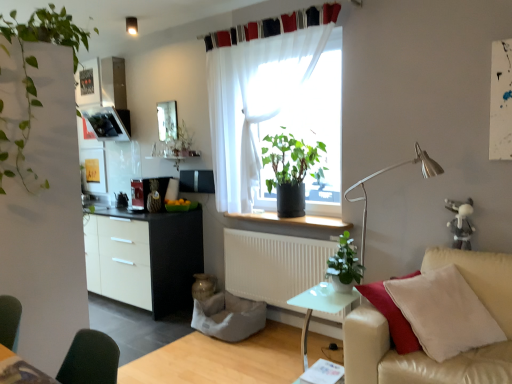
Question: From the image's perspective, is white matte cabinet at left located above metallic silver toaster at left?

Choices:
 (A) yes
 (B) no

Answer: (B)

Question: Is white matte cabinet at left wider than metallic silver toaster at left?

Choices:
 (A) yes
 (B) no

Answer: (A)

Question: Is white matte cabinet at left positioned before metallic silver toaster at left?

Choices:
 (A) no
 (B) yes

Answer: (B)

Question: Can you confirm if white matte cabinet at left is bigger than metallic silver toaster at left?

Choices:
 (A) yes
 (B) no

Answer: (A)

Question: Considering the relative sizes of white matte cabinet at left and metallic silver toaster at left in the image provided, is white matte cabinet at left taller than metallic silver toaster at left?

Choices:
 (A) no
 (B) yes

Answer: (B)

Question: Is white sheer curtain at upper center, which is the 2th curtain from bottom to top, inside or outside of metallic silver toaster at left?

Choices:
 (A) inside
 (B) outside

Answer: (B)

Question: Is white sheer curtain at upper center, which is the 2th curtain from bottom to top, taller or shorter than metallic silver toaster at left?

Choices:
 (A) short
 (B) tall

Answer: (A)

Question: From a real-world perspective, is white sheer curtain at upper center, which is the 2th curtain from bottom to top, positioned above or below metallic silver toaster at left?

Choices:
 (A) below
 (B) above

Answer: (B)

Question: Visually, is white sheer curtain at upper center, acting as the 1th curtain starting from the top, positioned to the left or to the right of metallic silver toaster at left?

Choices:
 (A) right
 (B) left

Answer: (A)

Question: Based on their sizes in the image, would you say white sheer curtain at upper center, which appears as the second curtain when viewed from the top, is bigger or smaller than translucent fabric at center, placed as the 2th window screen when sorted from left to right?

Choices:
 (A) big
 (B) small

Answer: (A)

Question: Considering the positions of white sheer curtain at upper center, acting as the first curtain starting from the bottom, and translucent fabric at center, arranged as the 1th window screen when viewed from the right, in the image, is white sheer curtain at upper center, acting as the first curtain starting from the bottom, wider or thinner than translucent fabric at center, arranged as the 1th window screen when viewed from the right,?

Choices:
 (A) wide
 (B) thin

Answer: (B)

Question: Considering the positions of white sheer curtain at upper center, acting as the first curtain starting from the bottom, and translucent fabric at center, arranged as the 1th window screen when viewed from the right, in the image, is white sheer curtain at upper center, acting as the first curtain starting from the bottom, taller or shorter than translucent fabric at center, arranged as the 1th window screen when viewed from the right,?

Choices:
 (A) short
 (B) tall

Answer: (B)

Question: Which is correct: white sheer curtain at upper center, which appears as the second curtain when viewed from the top, is inside translucent fabric at center, placed as the 2th window screen when sorted from left to right, or outside of it?

Choices:
 (A) inside
 (B) outside

Answer: (B)

Question: Considering the positions of metallic silver toaster at left and white metal table lamp at right in the image, is metallic silver toaster at left wider or thinner than white metal table lamp at right?

Choices:
 (A) thin
 (B) wide

Answer: (B)

Question: In terms of size, does metallic silver toaster at left appear bigger or smaller than white metal table lamp at right?

Choices:
 (A) small
 (B) big

Answer: (A)